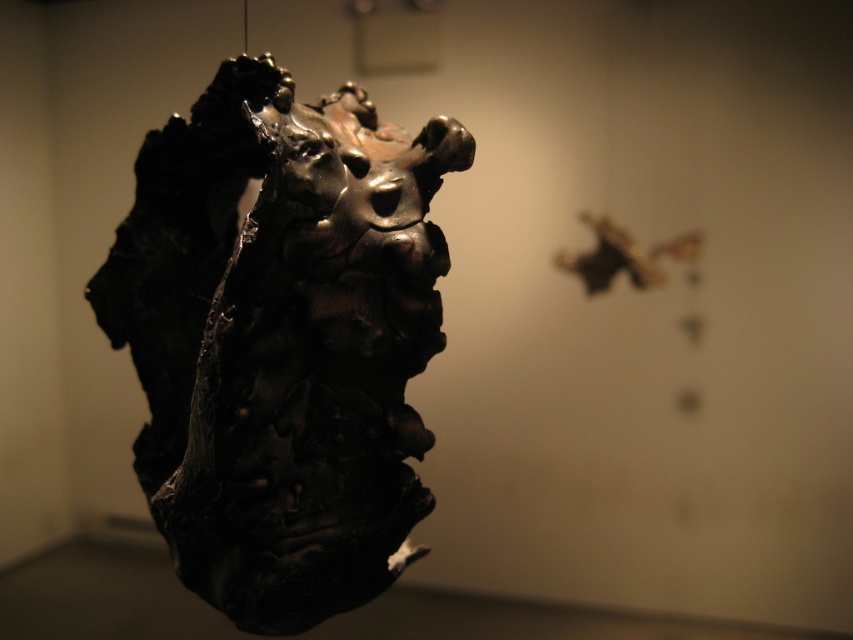
Is matte black sculpture at center shorter than shiny metallic butterfly at upper right?

Incorrect, matte black sculpture at center's height does not fall short of shiny metallic butterfly at upper right's.

Who is more forward, (271, 568) or (682, 257)?

Point (271, 568)

Identify the location of matte black sculpture at center. This screenshot has height=640, width=853. (281, 340).